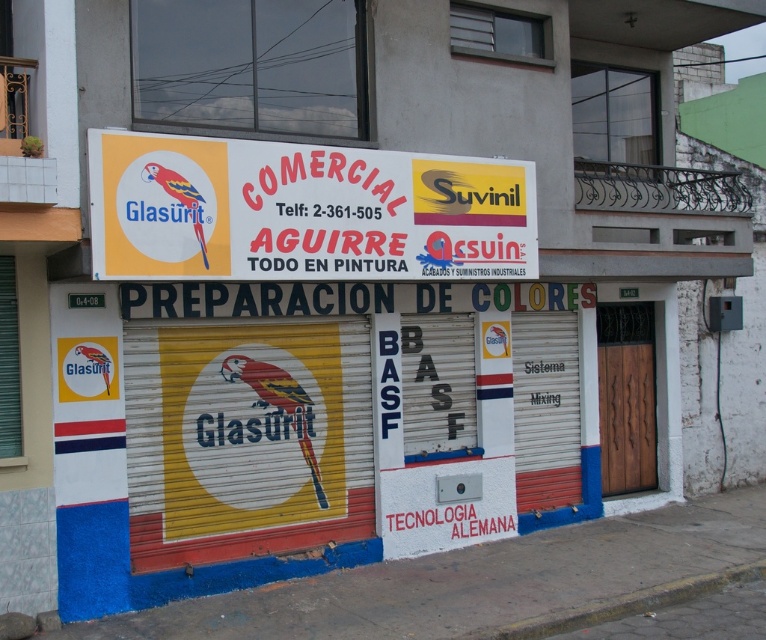
Question: Which point is farther to the camera?

Choices:
 (A) white plastic sign at upper center
 (B) concrete at lower center

Answer: (B)

Question: Observing the image, what is the correct spatial positioning of wooden door at right in reference to concrete at lower center?

Choices:
 (A) left
 (B) right

Answer: (B)

Question: Which point appears closest to the camera in this image?

Choices:
 (A) (601, 602)
 (B) (466, 259)
 (C) (643, 451)

Answer: (A)

Question: Is white plastic sign at upper center to the right of concrete at lower center from the viewer's perspective?

Choices:
 (A) yes
 (B) no

Answer: (B)

Question: Which point is farther to the camera?

Choices:
 (A) concrete at lower center
 (B) white plastic sign at upper center

Answer: (A)

Question: Can you confirm if wooden door at right is positioned to the right of concrete at lower center?

Choices:
 (A) no
 (B) yes

Answer: (B)